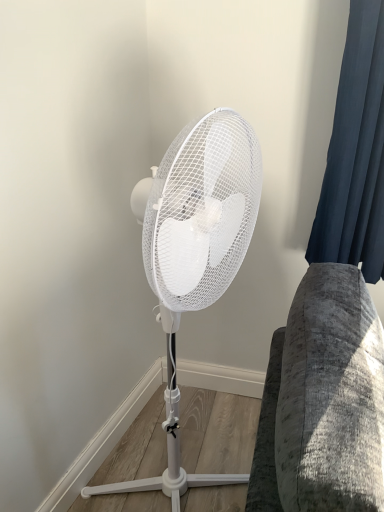
Find the location of a particular element. dark blue fabric at right is located at coordinates (355, 153).

What do you see at coordinates (355, 153) in the screenshot? I see `dark blue fabric at right` at bounding box center [355, 153].

Measure the distance between point (221, 478) and camera.

A distance of 1.41 meters exists between point (221, 478) and camera.

Describe the element at coordinates (194, 254) in the screenshot. I see `white matte mechanical fan at center` at that location.

Identify the location of white matte mechanical fan at center. This screenshot has width=384, height=512. (194, 254).

I want to click on dark blue fabric at right, so click(x=355, y=153).

Is white matte mechanical fan at center to the left of dark blue fabric at right from the viewer's perspective?

Correct, you'll find white matte mechanical fan at center to the left of dark blue fabric at right.

Is white matte mechanical fan at center positioned before dark blue fabric at right?

That is True.

Is point (208, 200) less distant than point (361, 127)?

Yes, point (208, 200) is closer to viewer.

From the image's perspective, which one is positioned higher, white matte mechanical fan at center or dark blue fabric at right?

dark blue fabric at right appears higher in the image.

Looking at this image, from a real-world perspective, which object rests below the other?

white matte mechanical fan at center, from a real-world perspective.

Can you confirm if white matte mechanical fan at center is thinner than dark blue fabric at right?

In fact, white matte mechanical fan at center might be wider than dark blue fabric at right.

Considering the sizes of white matte mechanical fan at center and dark blue fabric at right in the image, is white matte mechanical fan at center taller or shorter than dark blue fabric at right?

Considering their sizes, white matte mechanical fan at center has more height than dark blue fabric at right.

Considering the sizes of objects white matte mechanical fan at center and dark blue fabric at right in the image provided, who is bigger, white matte mechanical fan at center or dark blue fabric at right?

white matte mechanical fan at center.

Is white matte mechanical fan at center inside the boundaries of dark blue fabric at right, or outside?

white matte mechanical fan at center lies outside dark blue fabric at right.

Is white matte mechanical fan at center placed right next to dark blue fabric at right?

white matte mechanical fan at center and dark blue fabric at right are not in contact.

Is white matte mechanical fan at center oriented towards dark blue fabric at right?

No, white matte mechanical fan at center is not aimed at dark blue fabric at right.

How different are the orientations of white matte mechanical fan at center and dark blue fabric at right in degrees?

There is a 69.6-degree angle between the facing directions of white matte mechanical fan at center and dark blue fabric at right.

Find the location of `curtain lying on the right of white matte mechanical fan at center`. curtain lying on the right of white matte mechanical fan at center is located at coordinates (355, 153).

Based on the photo, can you confirm if dark blue fabric at right is positioned to the right of white matte mechanical fan at center?

Indeed, dark blue fabric at right is positioned on the right side of white matte mechanical fan at center.

From the picture: In the image, is dark blue fabric at right positioned in front of or behind white matte mechanical fan at center?

Clearly, dark blue fabric at right is behind white matte mechanical fan at center.

Is point (369, 28) farther from viewer compared to point (238, 216)?

Yes, point (369, 28) is farther from viewer.

From the image's perspective, is dark blue fabric at right positioned above or below white matte mechanical fan at center?

dark blue fabric at right is above white matte mechanical fan at center.

From a real-world perspective, is dark blue fabric at right positioned above or below white matte mechanical fan at center?

Clearly, from a real-world perspective, dark blue fabric at right is above white matte mechanical fan at center.

Which object is thinner, dark blue fabric at right or white matte mechanical fan at center?

dark blue fabric at right.

Is dark blue fabric at right taller than white matte mechanical fan at center?

In fact, dark blue fabric at right may be shorter than white matte mechanical fan at center.

Is dark blue fabric at right smaller than white matte mechanical fan at center?

Yes.

Is white matte mechanical fan at center located within dark blue fabric at right?

No, white matte mechanical fan at center is not a part of dark blue fabric at right.

Based on the photo, are dark blue fabric at right and white matte mechanical fan at center making contact?

dark blue fabric at right is not next to white matte mechanical fan at center, and they're not touching.

Is dark blue fabric at right facing away from white matte mechanical fan at center?

No, dark blue fabric at right is not facing the opposite direction of white matte mechanical fan at center.

Locate an element on the screen. mechanical fan below the dark blue fabric at right (from a real-world perspective) is located at coordinates (194, 254).

The height and width of the screenshot is (512, 384). Find the location of `mechanical fan below the dark blue fabric at right (from the image's perspective)`. mechanical fan below the dark blue fabric at right (from the image's perspective) is located at coordinates (194, 254).

Locate an element on the screen. This screenshot has width=384, height=512. mechanical fan that is in front of the dark blue fabric at right is located at coordinates (194, 254).